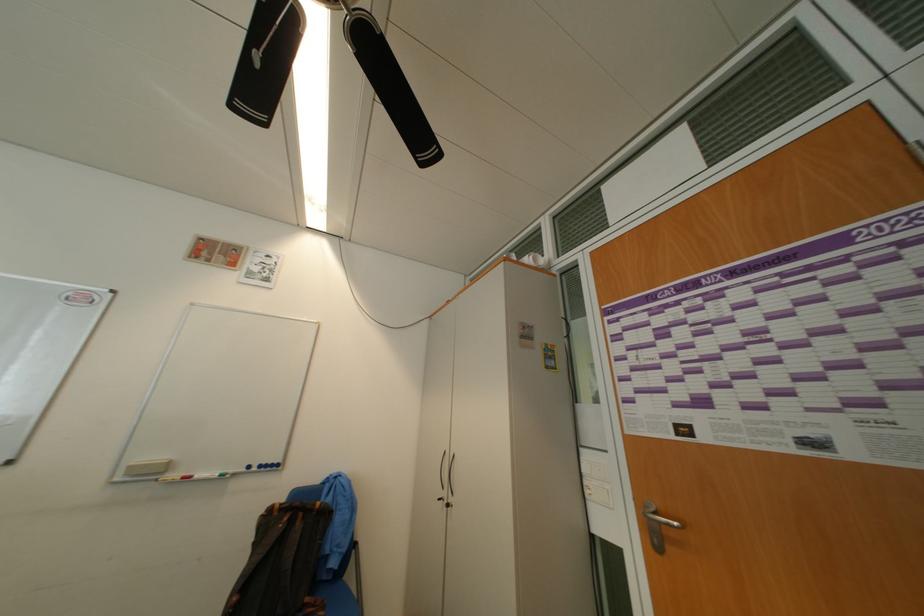
The width and height of the screenshot is (924, 616). What do you see at coordinates (658, 522) in the screenshot? I see `a silver door handle` at bounding box center [658, 522].